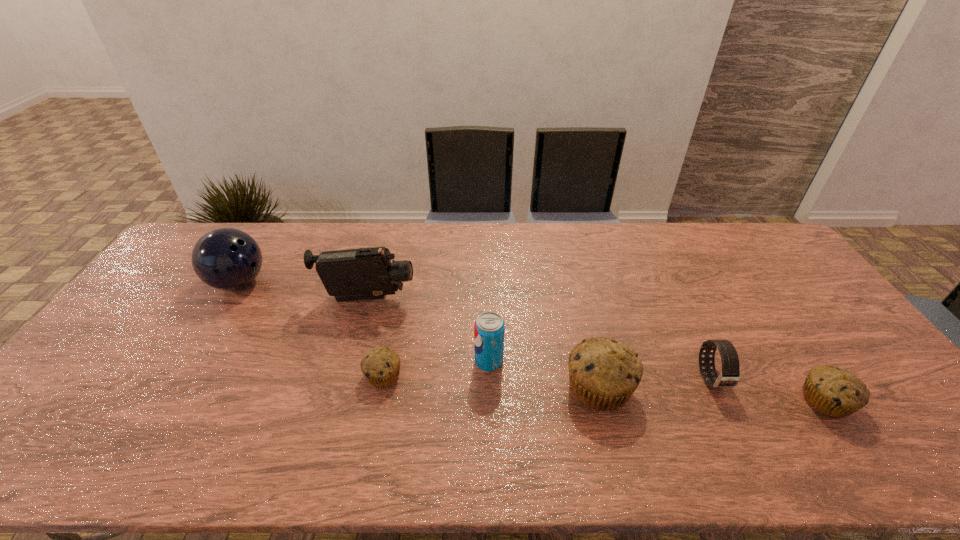
I want to click on vacant place for an extra muffin on the left, so click(179, 363).